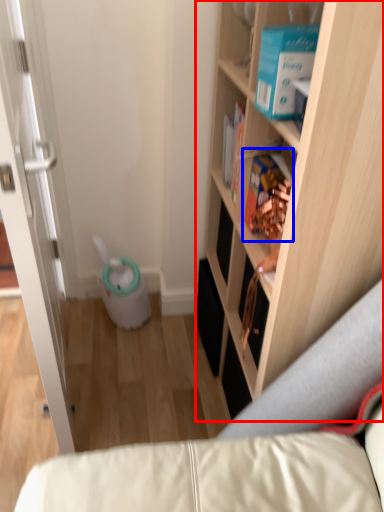
Question: Among these objects, which one is farthest to the camera, cabinetry (highlighted by a red box) or book (highlighted by a blue box)?

Choices:
 (A) cabinetry
 (B) book

Answer: (B)